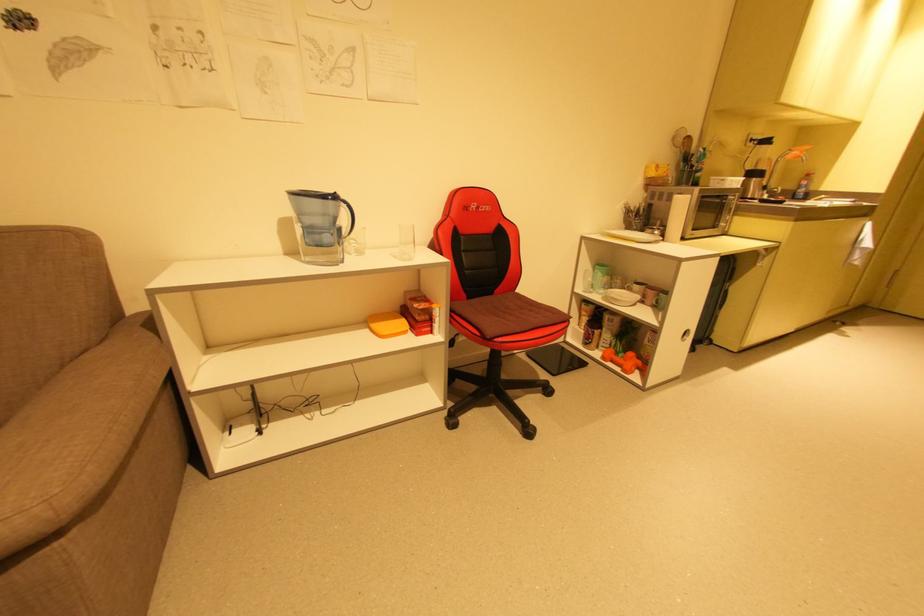
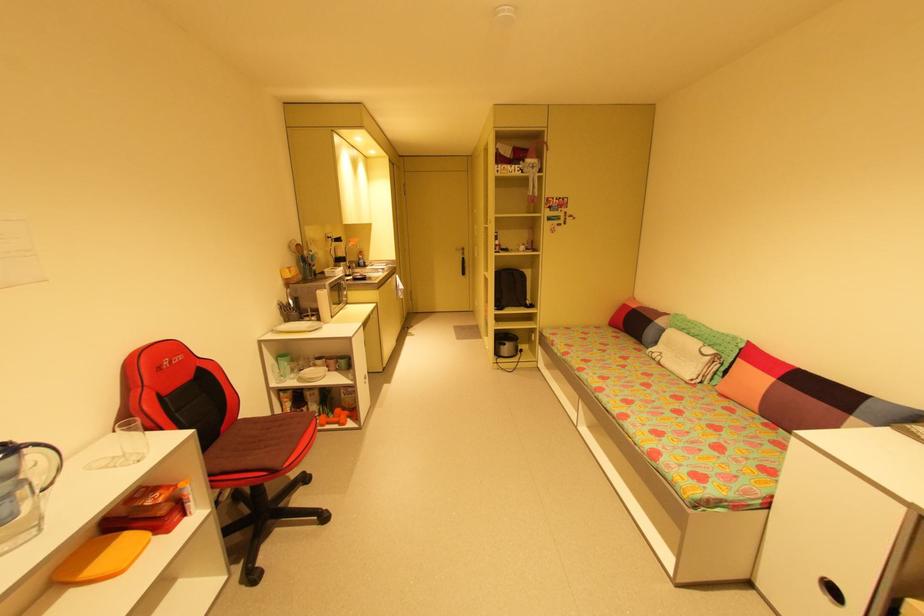
Find the pixel in the second image that matches [629,368] in the first image.

(345, 422)